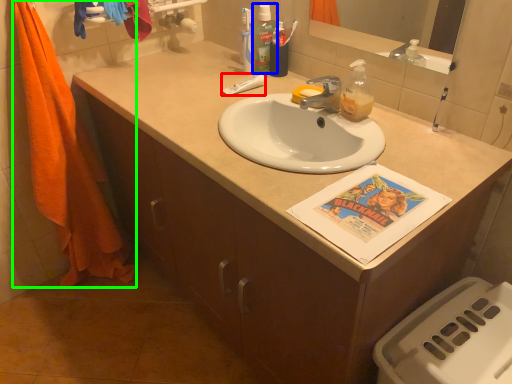
Question: Based on their relative distances, which object is farther from toothpaste (highlighted by a red box)? Choose from mouthwash (highlighted by a blue box) and beach towel (highlighted by a green box).

Choices:
 (A) mouthwash
 (B) beach towel

Answer: (B)